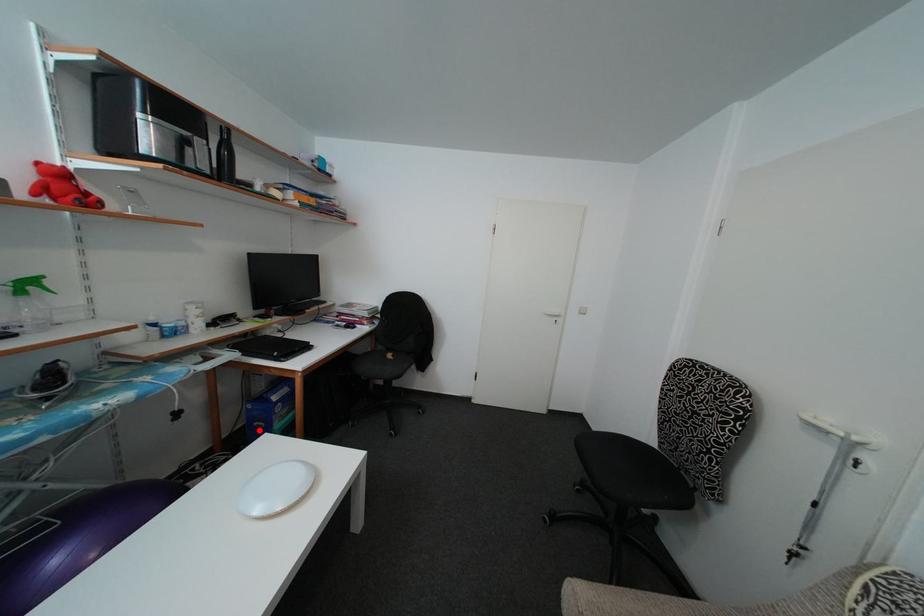
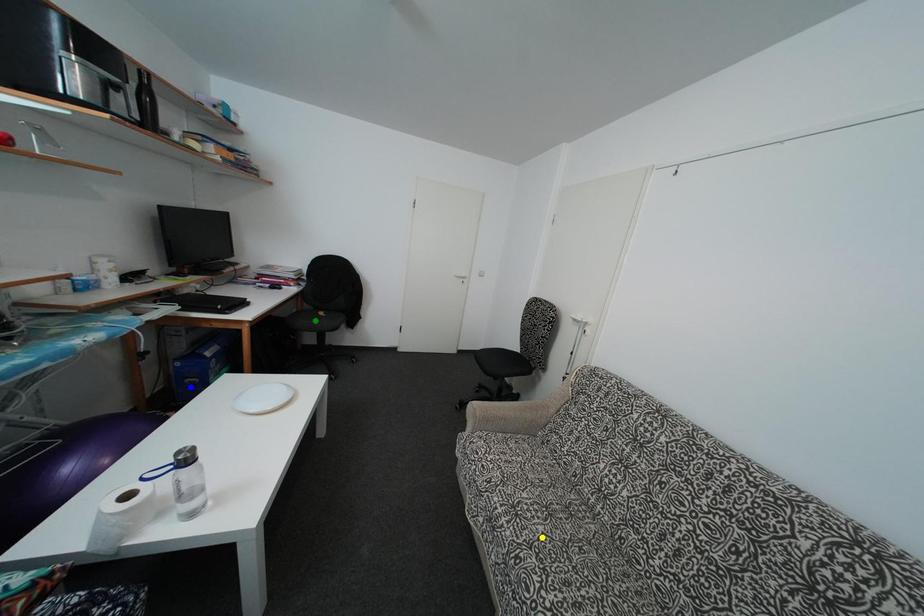
Question: I am providing you with two images of the same scene from different viewpoints. A red point is marked on the first image. You are given multiple points on the second image. Which mark in image 2 goes with the point in image 1?

Choices:
 (A) blue point
 (B) green point
 (C) yellow point

Answer: (A)